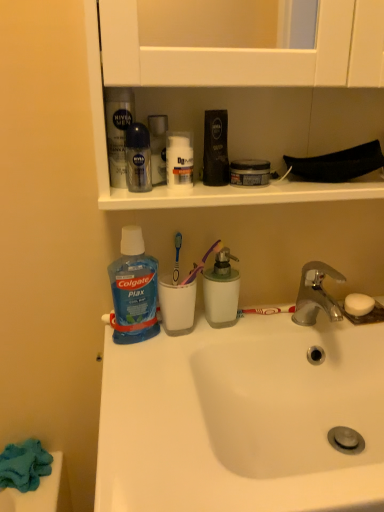
I want to click on free space in front of blue translucent liquid at lower left, so click(x=143, y=384).